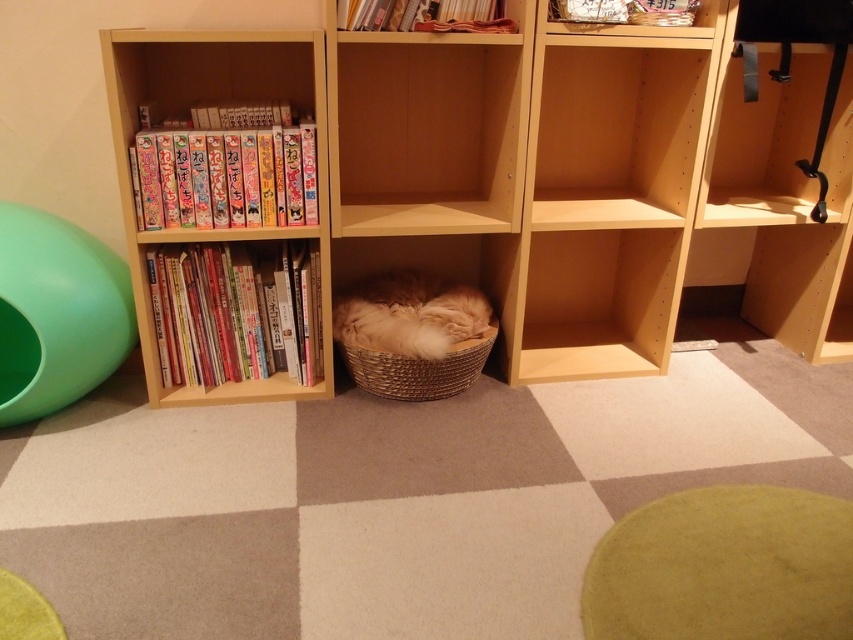
Who is positioned more to the left, green rubber ball at left or matte paper manga at left?

green rubber ball at left is more to the left.

Measure the distance between green rubber ball at left and matte paper manga at left.

green rubber ball at left and matte paper manga at left are 14.47 inches apart.

Is point (4, 422) farther from camera compared to point (277, 173)?

That is True.

Image resolution: width=853 pixels, height=640 pixels. Identify the location of green rubber ball at left. point(57,312).

Measure the distance between natural wood bookcase at left and fuzzy beige cat at center.

natural wood bookcase at left is 14.22 inches away from fuzzy beige cat at center.

Is the position of natural wood bookcase at left less distant than that of fuzzy beige cat at center?

Yes.

Is point (622, 342) farther from camera compared to point (469, 326)?

Yes, point (622, 342) is farther from viewer.

Find the location of a particular element. natural wood bookcase at left is located at coordinates (585, 179).

Which is above, natural wood bookcase at left or matte paper manga at left?

matte paper manga at left

This screenshot has height=640, width=853. I want to click on natural wood bookcase at left, so click(585, 179).

Is point (347, 220) less distant than point (157, 160)?

That is False.

Image resolution: width=853 pixels, height=640 pixels. I want to click on natural wood bookcase at left, so click(x=585, y=179).